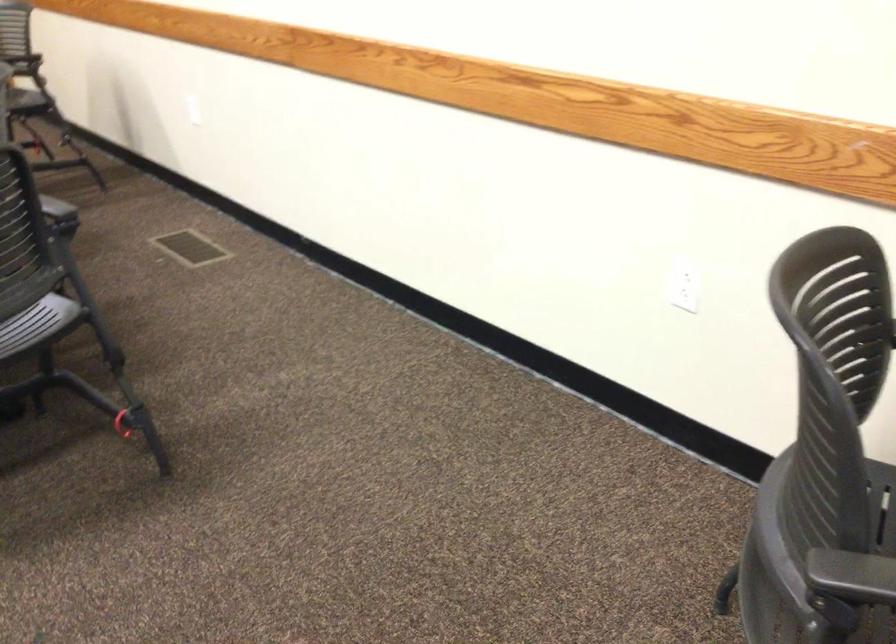
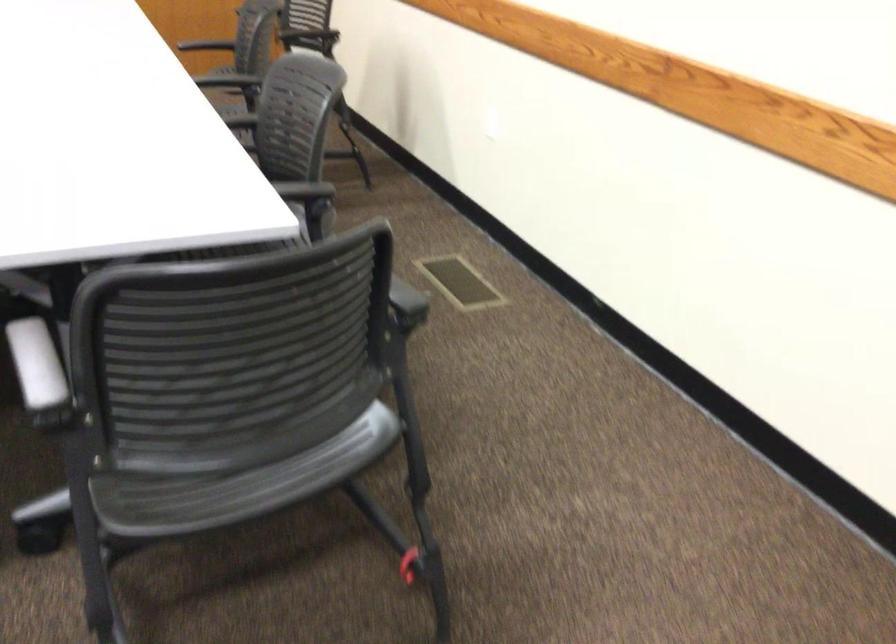
Question: The camera is either moving clockwise (left) or counter-clockwise (right) around the object. The first image is from the beginning of the video and the second image is from the end. Is the camera moving left or right when shooting the video?

Choices:
 (A) Left
 (B) Right

Answer: (B)